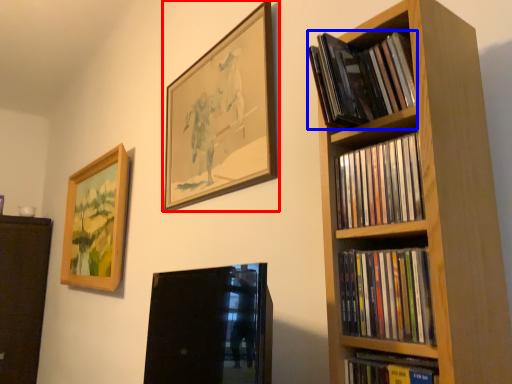
Question: Which point is further to the camera, picture frame (highlighted by a red box) or book (highlighted by a blue box)?

Choices:
 (A) picture frame
 (B) book

Answer: (A)